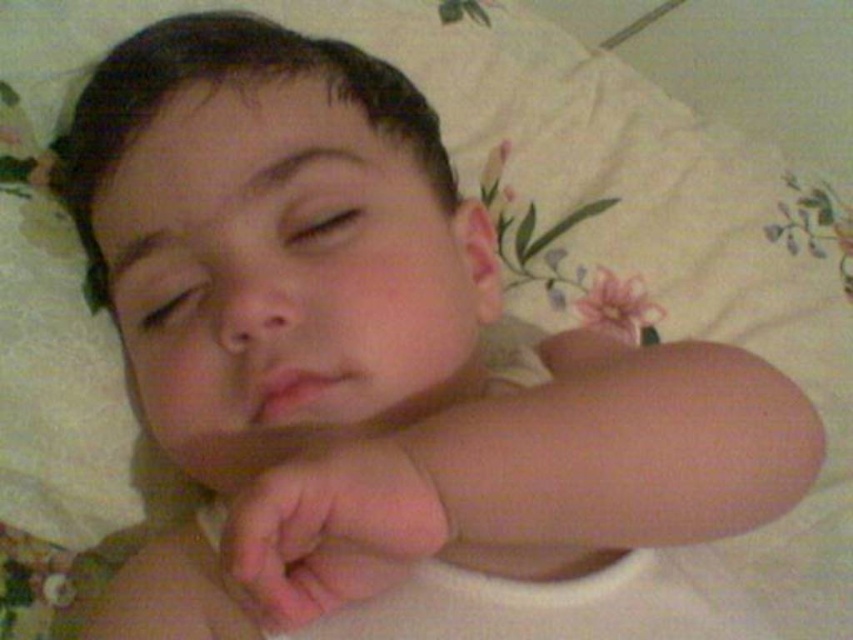
Question: Considering the relative positions of smooth skin baby at center and pink flesh at center in the image provided, where is smooth skin baby at center located with respect to pink flesh at center?

Choices:
 (A) right
 (B) left

Answer: (B)

Question: Observing the image, what is the correct spatial positioning of pink smooth skin at center in reference to pink flesh at center?

Choices:
 (A) below
 (B) above

Answer: (A)

Question: Based on their relative distances, which object is farther from the pink flesh at center?

Choices:
 (A) smooth skin baby at center
 (B) pink smooth skin at center

Answer: (A)

Question: Which point is closer to the camera?

Choices:
 (A) (479, 529)
 (B) (117, 141)
 (C) (325, 506)

Answer: (C)

Question: Which point is closer to the camera?

Choices:
 (A) pink flesh at center
 (B) pink smooth skin at center

Answer: (B)

Question: Is smooth skin baby at center smaller than pink smooth skin at center?

Choices:
 (A) yes
 (B) no

Answer: (B)